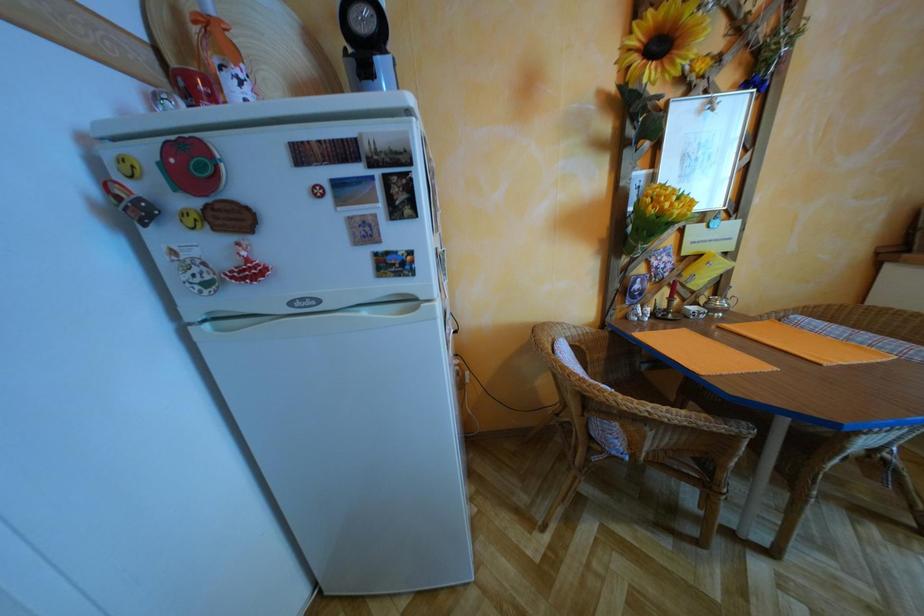
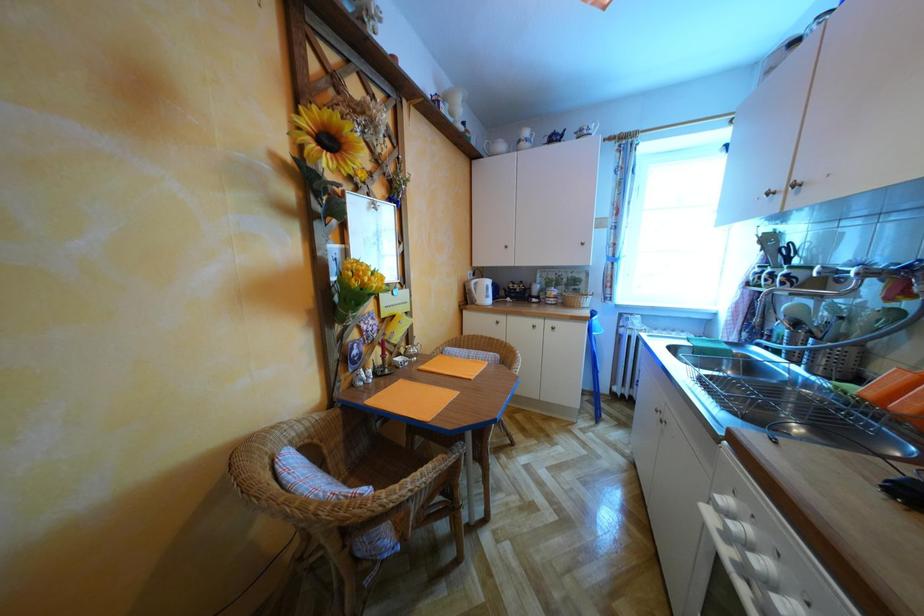
Question: How did the camera likely rotate?

Choices:
 (A) Left
 (B) Right
 (C) Up
 (D) Down

Answer: (B)